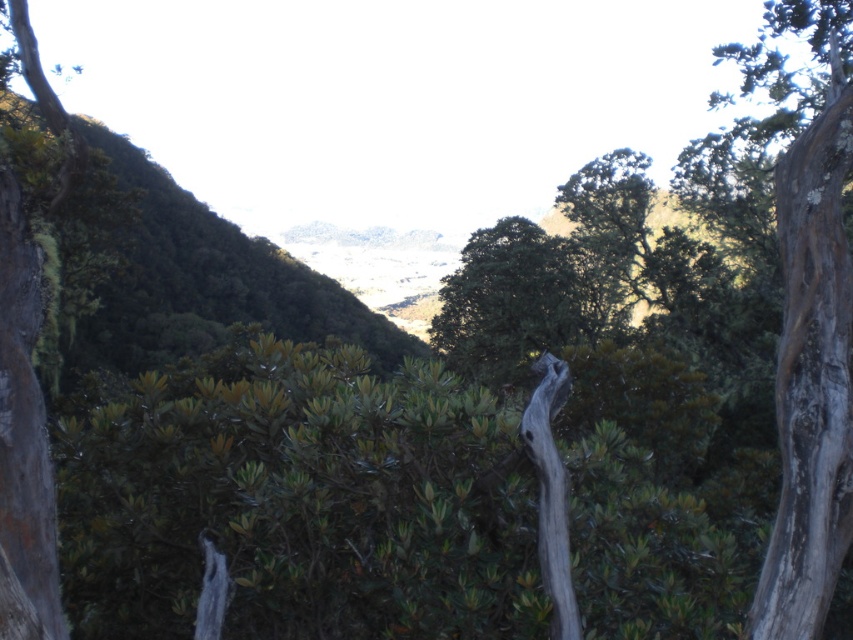
Does point (817, 202) come farther from viewer compared to point (495, 301)?

That is False.

What do you see at coordinates (804, 300) in the screenshot?
I see `gray textured bark at right` at bounding box center [804, 300].

Who is more forward, (770, 90) or (463, 342)?

Point (770, 90)

Locate an element on the screen. gray textured bark at right is located at coordinates (804, 300).